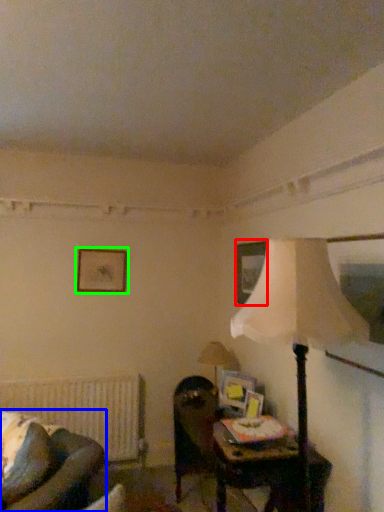
Question: Which object is positioned closest to picture frame (highlighted by a red box)? Select from rocking chair (highlighted by a blue box) and picture frame (highlighted by a green box).

Choices:
 (A) rocking chair
 (B) picture frame

Answer: (B)